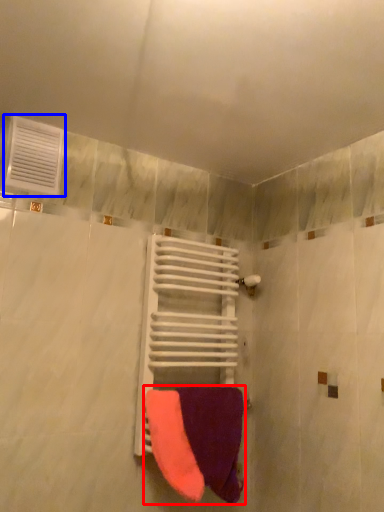
Question: Which point is closer to the camera, towel (highlighted by a red box) or air conditioning (highlighted by a blue box)?

Choices:
 (A) towel
 (B) air conditioning

Answer: (A)